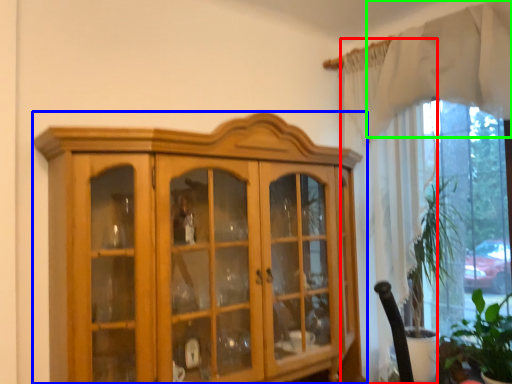
Question: Considering the real-world distances, which object is closest to curtain (highlighted by a red box)? cupboard (highlighted by a blue box) or curtain (highlighted by a green box).

Choices:
 (A) cupboard
 (B) curtain

Answer: (B)